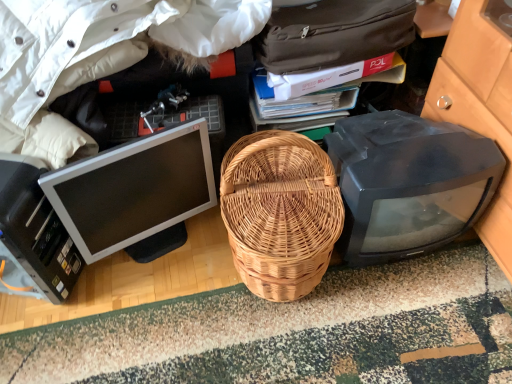
Find the location of a particular element. This screenshot has width=512, height=384. vacant space in front of black plastic printer at lower left is located at coordinates (42, 340).